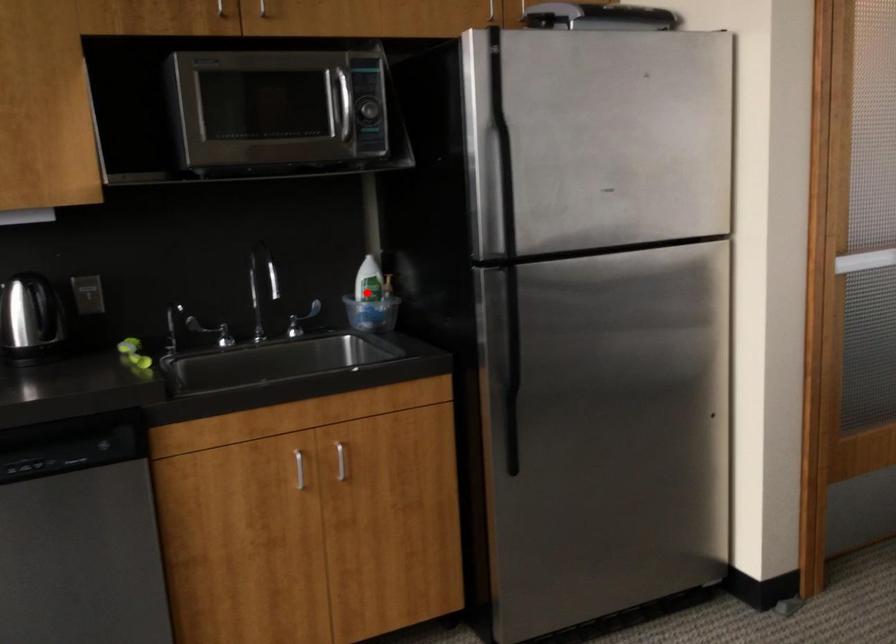
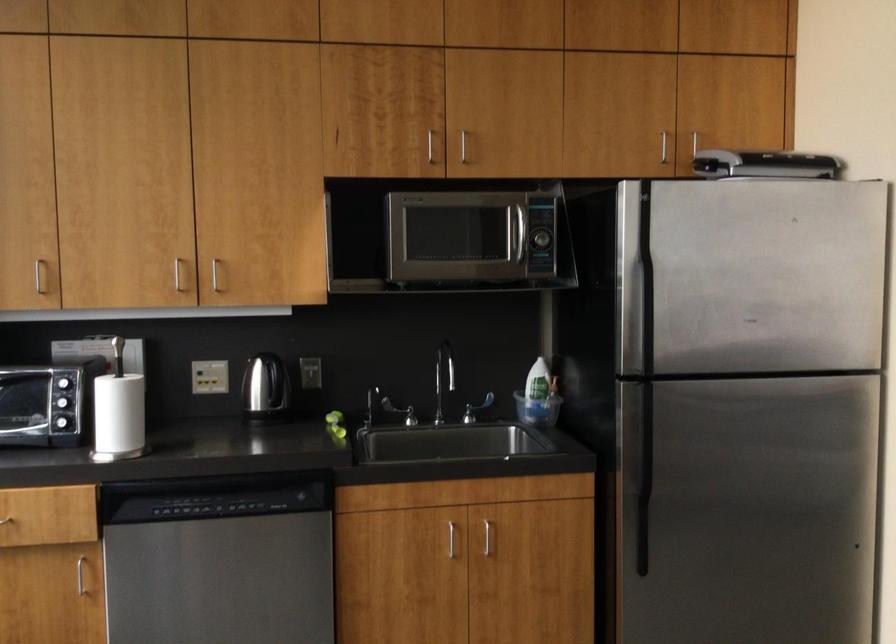
In the second image, find the point that corresponds to the highlighted location in the first image.

(539, 391)